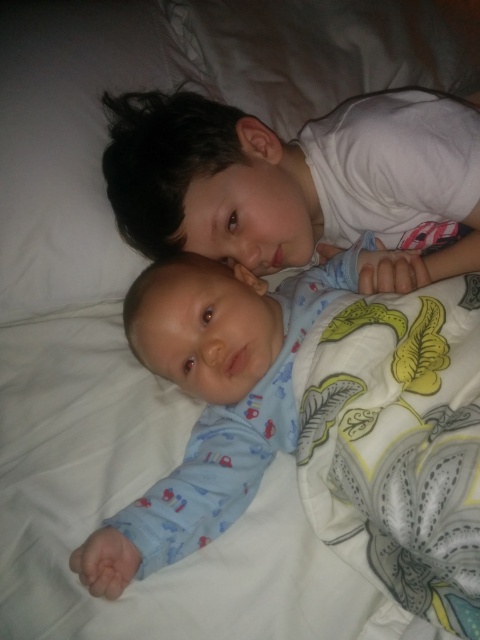
Consider the image. You are a photographer trying to capture a closeup of both the white smooth shirt at upper center and the blue cotton onesie at center. Since you want both to be fully visible in the frame, which clothing item should you focus on first to ensure it stays in the shot?

The white smooth shirt at upper center is not as tall as the blue cotton onesie at center, so you should focus on the blue cotton onesie at center first to ensure it stays in the frame since it is taller.

You are a photographer taking a picture of the two children on the bed. You want to place a small sticker exactly at the point with coordinates point (299, 180). Which object will the sticker be placed on?

The point (299, 180) is on the white smooth shirt at upper center, so the sticker will be placed on the white smooth shirt at upper center.

You are a photographer standing 3 feet away from the bed. You want to take a closeup shot of the white smooth shirt at upper center. Can you reach it with your camera lens without moving closer than your current position?

The distance of white smooth shirt at upper center from viewer is 31.00 inches, which is approximately 2.58 feet. Since you are standing 3 feet away, your camera lens can reach it without moving closer.